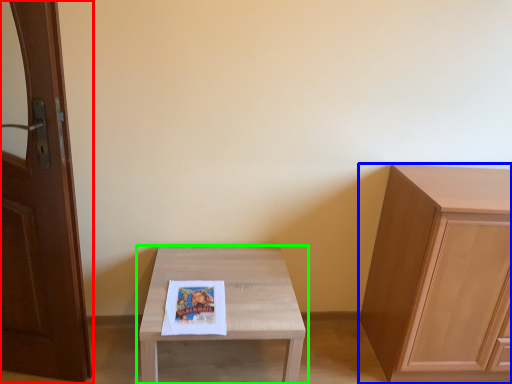
Question: Estimate the real-world distances between objects in this image. Which object is farther from door (highlighted by a red box), cabinetry (highlighted by a blue box) or table (highlighted by a green box)?

Choices:
 (A) cabinetry
 (B) table

Answer: (A)